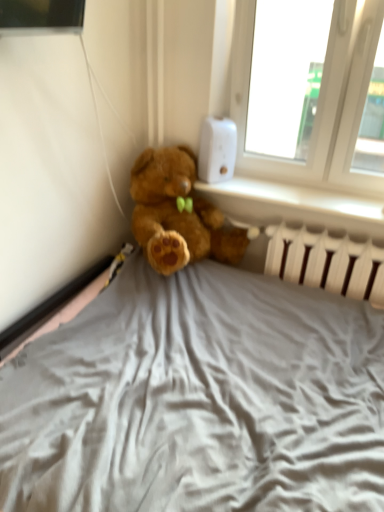
Question: Does white plastic radiator at lower right have a greater height compared to white plastic thermostat at upper right?

Choices:
 (A) yes
 (B) no

Answer: (A)

Question: From the image's perspective, is white plastic radiator at lower right over white plastic thermostat at upper right?

Choices:
 (A) yes
 (B) no

Answer: (B)

Question: Can white plastic thermostat at upper right be found inside white plastic radiator at lower right?

Choices:
 (A) no
 (B) yes

Answer: (A)

Question: Would you say white plastic radiator at lower right is a long distance from white plastic thermostat at upper right?

Choices:
 (A) no
 (B) yes

Answer: (A)

Question: Considering the relative sizes of white plastic radiator at lower right and white plastic thermostat at upper right in the image provided, is white plastic radiator at lower right bigger than white plastic thermostat at upper right?

Choices:
 (A) yes
 (B) no

Answer: (A)

Question: Does white plastic radiator at lower right appear on the left side of white plastic thermostat at upper right?

Choices:
 (A) yes
 (B) no

Answer: (B)

Question: Is white plastic radiator at lower right positioned in front of white plastic radiator at lower right?

Choices:
 (A) yes
 (B) no

Answer: (B)

Question: Is white plastic radiator at lower right positioned with its back to white plastic radiator at lower right?

Choices:
 (A) yes
 (B) no

Answer: (B)

Question: Does white plastic radiator at lower right have a smaller size compared to white plastic radiator at lower right?

Choices:
 (A) no
 (B) yes

Answer: (B)

Question: Does white plastic radiator at lower right lie behind white plastic radiator at lower right?

Choices:
 (A) yes
 (B) no

Answer: (A)

Question: Could you tell me if white plastic radiator at lower right is turned towards white plastic radiator at lower right?

Choices:
 (A) no
 (B) yes

Answer: (A)

Question: Is white plastic radiator at lower right next to white plastic radiator at lower right and touching it?

Choices:
 (A) no
 (B) yes

Answer: (A)

Question: Does white plastic thermostat at upper right come behind white plastic radiator at lower right?

Choices:
 (A) yes
 (B) no

Answer: (A)